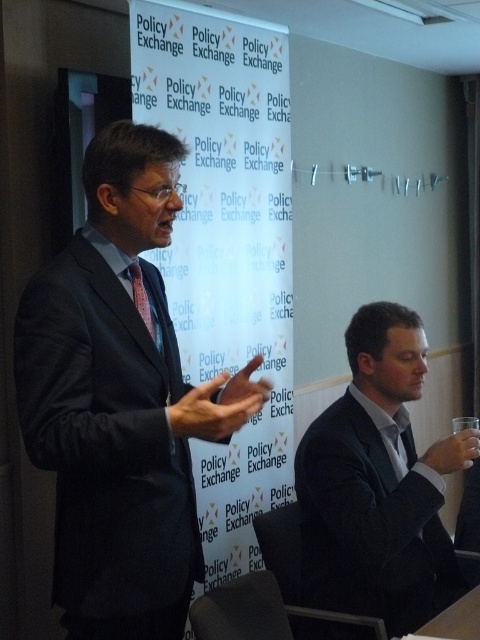
Can you confirm if dark gray suit at center is taller than dark gray suit at right?

Yes, dark gray suit at center is taller than dark gray suit at right.

Who is more forward, (231, 404) or (328, 481)?

Point (231, 404)

Identify the location of dark gray suit at center. The width and height of the screenshot is (480, 640). coord(120,401).

Who is taller, dark gray suit at center or pink silk tie at center?

Standing taller between the two is dark gray suit at center.

Who is more distant from viewer, [126,301] or [142,284]?

The point [142,284] is behind.

Is point (101, 460) behind point (146, 292)?

That is False.

Image resolution: width=480 pixels, height=640 pixels. What are the coordinates of `dark gray suit at center` in the screenshot? It's located at tap(120, 401).

Does dark gray suit at right appear over pink silk tie at center?

No.

Is dark gray suit at right wider than pink silk tie at center?

Correct, the width of dark gray suit at right exceeds that of pink silk tie at center.

Is point (362, 369) positioned before point (146, 324)?

That is False.

This screenshot has height=640, width=480. I want to click on dark gray suit at right, so click(379, 484).